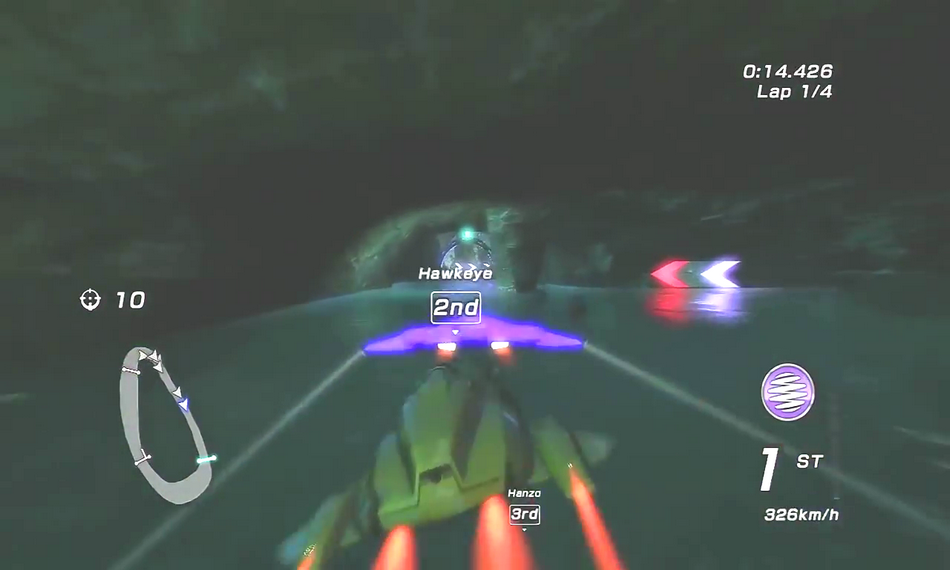
Where is `teal light`? Image resolution: width=950 pixels, height=570 pixels. teal light is located at coordinates pos(467,237).